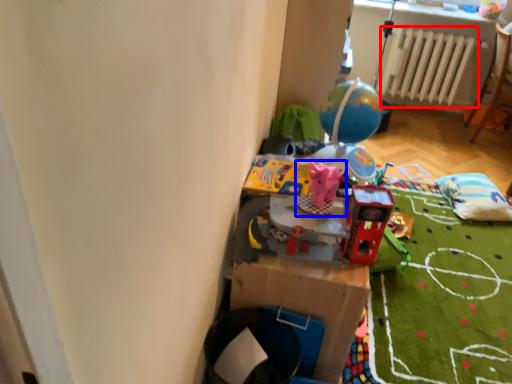
Question: Among these objects, which one is nearest to the camera, radiator (highlighted by a red box) or toy (highlighted by a blue box)?

Choices:
 (A) radiator
 (B) toy

Answer: (B)